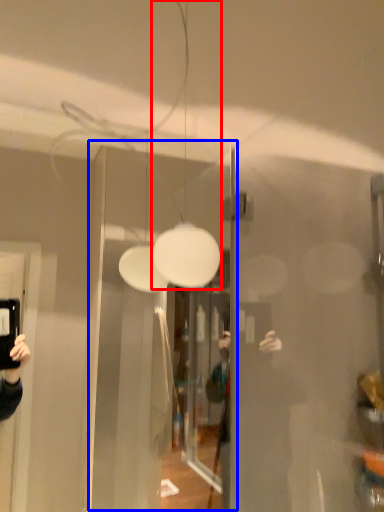
Question: Which of the following is the farthest to the observer, light fixture (highlighted by a red box) or glass door (highlighted by a blue box)?

Choices:
 (A) light fixture
 (B) glass door

Answer: (A)